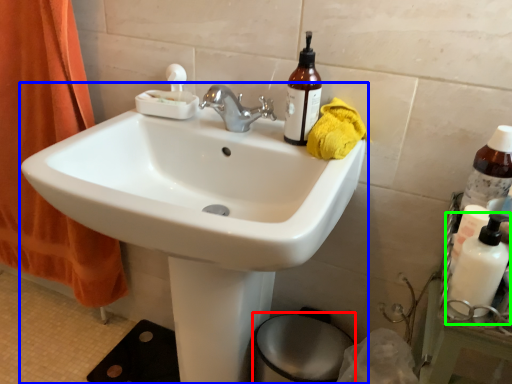
Question: Which is farther away from bidet (highlighted by a red box)? sink (highlighted by a blue box) or cleaning product (highlighted by a green box)?

Choices:
 (A) sink
 (B) cleaning product

Answer: (B)